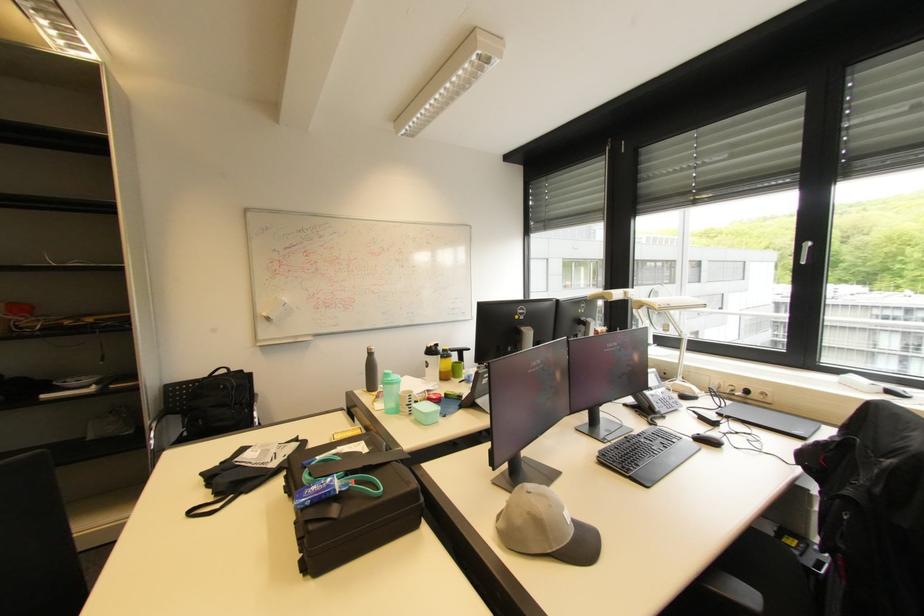
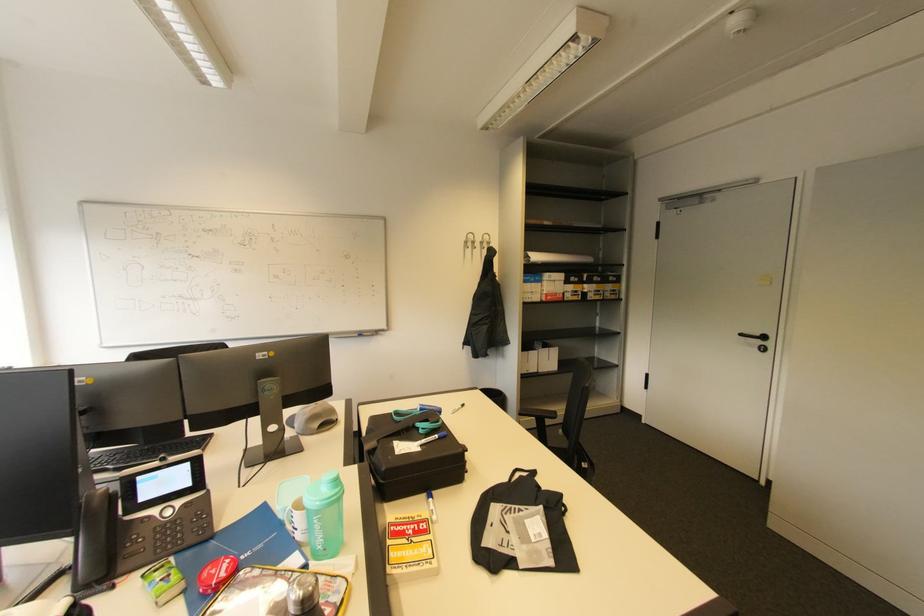
The point at (368,442) is marked in the first image. Where is the corresponding point in the second image?

(402, 455)